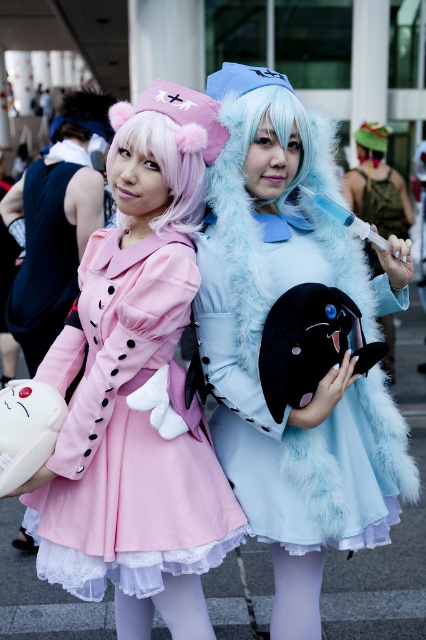
Who is positioned more to the left, matte pink coat at center or fuzzy blue dress at center?

matte pink coat at center

Can you confirm if matte pink coat at center is positioned to the left of fuzzy blue dress at center?

Indeed, matte pink coat at center is positioned on the left side of fuzzy blue dress at center.

Find the location of a particular element. The width and height of the screenshot is (426, 640). matte pink coat at center is located at coordinates (138, 388).

Can you confirm if matte pink coat at center is thinner than pink fluffy wig at center?

In fact, matte pink coat at center might be wider than pink fluffy wig at center.

This screenshot has width=426, height=640. What do you see at coordinates (138, 388) in the screenshot?
I see `matte pink coat at center` at bounding box center [138, 388].

Describe the element at coordinates (138, 388) in the screenshot. The image size is (426, 640). I see `matte pink coat at center` at that location.

Image resolution: width=426 pixels, height=640 pixels. I want to click on matte pink coat at center, so click(138, 388).

Is matte pink coat at center taller than light blue furry wig at center?

Yes, matte pink coat at center is taller than light blue furry wig at center.

Which is above, matte pink coat at center or light blue furry wig at center?

Positioned higher is light blue furry wig at center.

Does point (112, 177) come in front of point (270, 104)?

No, it is not.

Locate an element on the screen. The width and height of the screenshot is (426, 640). matte pink coat at center is located at coordinates (138, 388).